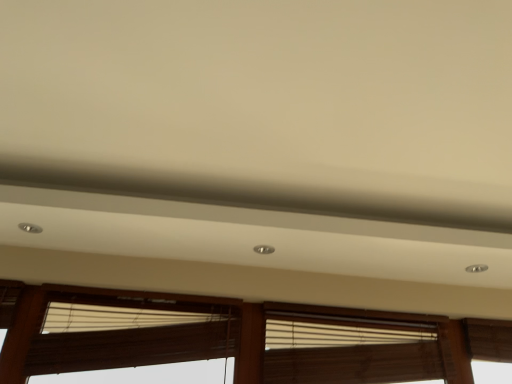
Question: Is brown fabric window blind at lower center, which ranks as the first window blind in left-to-right order, thinner than wooden blinds at center, the second window blind in the left-to-right sequence?

Choices:
 (A) no
 (B) yes

Answer: (B)

Question: Considering the relative positions of brown fabric window blind at lower center, which ranks as the first window blind in left-to-right order, and wooden blinds at center, which ranks as the first window blind in right-to-left order, in the image provided, is brown fabric window blind at lower center, which ranks as the first window blind in left-to-right order, to the left of wooden blinds at center, which ranks as the first window blind in right-to-left order, from the viewer's perspective?

Choices:
 (A) no
 (B) yes

Answer: (B)

Question: Considering the relative sizes of brown fabric window blind at lower center, which ranks as the first window blind in left-to-right order, and wooden blinds at center, the second window blind in the left-to-right sequence, in the image provided, is brown fabric window blind at lower center, which ranks as the first window blind in left-to-right order, wider than wooden blinds at center, the second window blind in the left-to-right sequence,?

Choices:
 (A) yes
 (B) no

Answer: (B)

Question: Is brown fabric window blind at lower center, which ranks as the first window blind in left-to-right order, smaller than wooden blinds at center, which ranks as the first window blind in right-to-left order?

Choices:
 (A) no
 (B) yes

Answer: (B)

Question: Could you tell me if brown fabric window blind at lower center, which is the second window blind in right-to-left order, is turned towards wooden blinds at center, which ranks as the first window blind in right-to-left order?

Choices:
 (A) yes
 (B) no

Answer: (B)

Question: From the image's perspective, is brown fabric window blind at lower center, which ranks as the first window blind in left-to-right order, below wooden blinds at center, which ranks as the first window blind in right-to-left order?

Choices:
 (A) yes
 (B) no

Answer: (B)

Question: Can we say wooden blinds at center, which ranks as the first window blind in right-to-left order, lies outside wooden blinds at lower center?

Choices:
 (A) yes
 (B) no

Answer: (B)

Question: Is there a large distance between wooden blinds at center, which ranks as the first window blind in right-to-left order, and wooden blinds at lower center?

Choices:
 (A) no
 (B) yes

Answer: (A)

Question: Can you confirm if wooden blinds at center, which ranks as the first window blind in right-to-left order, is taller than wooden blinds at lower center?

Choices:
 (A) no
 (B) yes

Answer: (A)

Question: Is wooden blinds at center, the second window blind in the left-to-right sequence, turned away from wooden blinds at lower center?

Choices:
 (A) no
 (B) yes

Answer: (B)

Question: Does wooden blinds at center, which ranks as the first window blind in right-to-left order, have a greater width compared to wooden blinds at lower center?

Choices:
 (A) yes
 (B) no

Answer: (A)

Question: Is the depth of wooden blinds at center, which ranks as the first window blind in right-to-left order, less than that of wooden blinds at lower center?

Choices:
 (A) no
 (B) yes

Answer: (A)

Question: Can you confirm if wooden blinds at lower center is wider than brown fabric window blind at lower center, which ranks as the first window blind in left-to-right order?

Choices:
 (A) yes
 (B) no

Answer: (B)